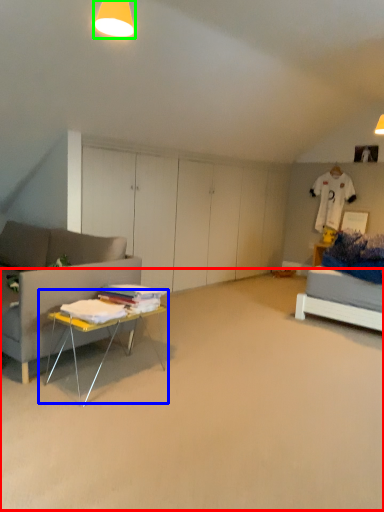
Question: Which is farther away from plain (highlighted by a red box)? table (highlighted by a blue box) or lighting (highlighted by a green box)?

Choices:
 (A) table
 (B) lighting

Answer: (B)